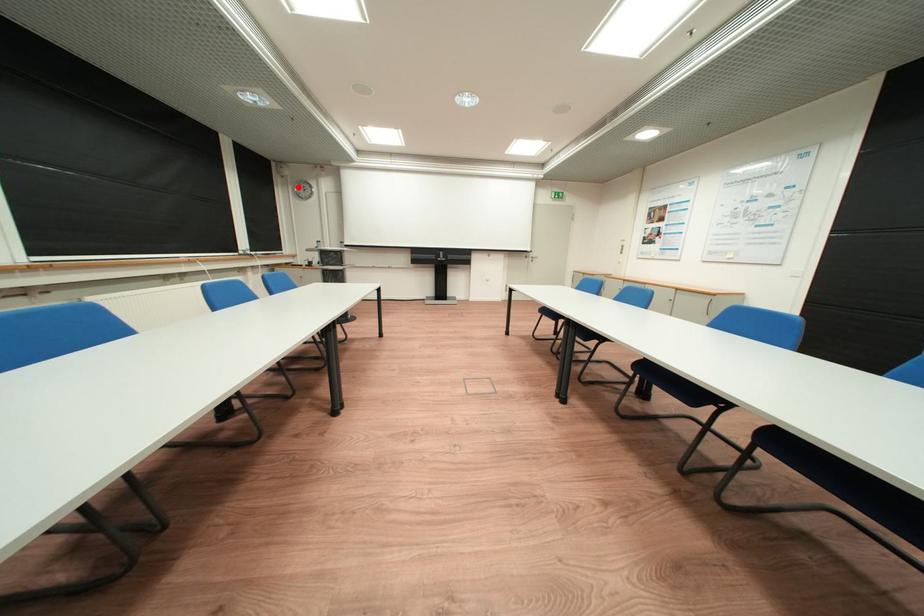
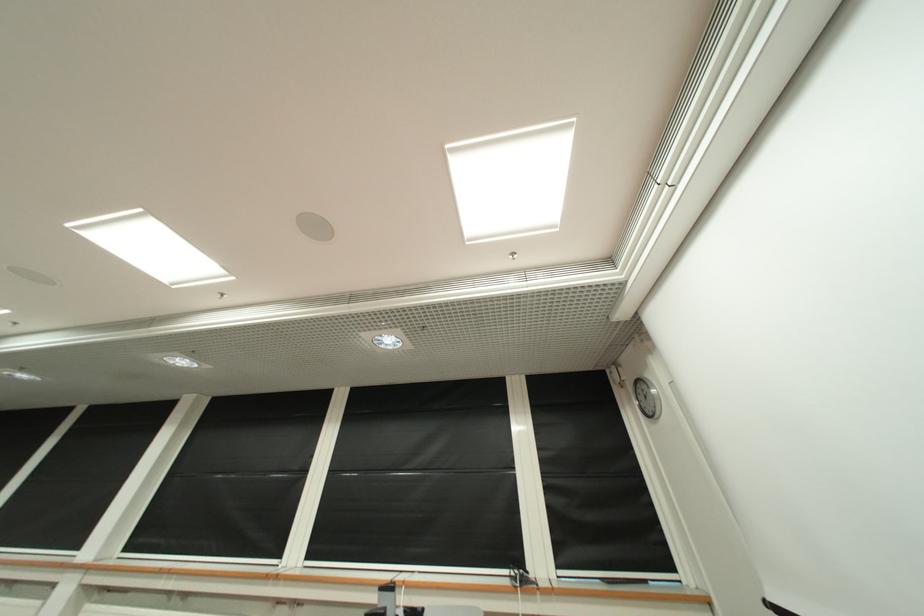
The point at the highlighted location is marked in the first image. Where is the corresponding point in the second image?

(642, 402)